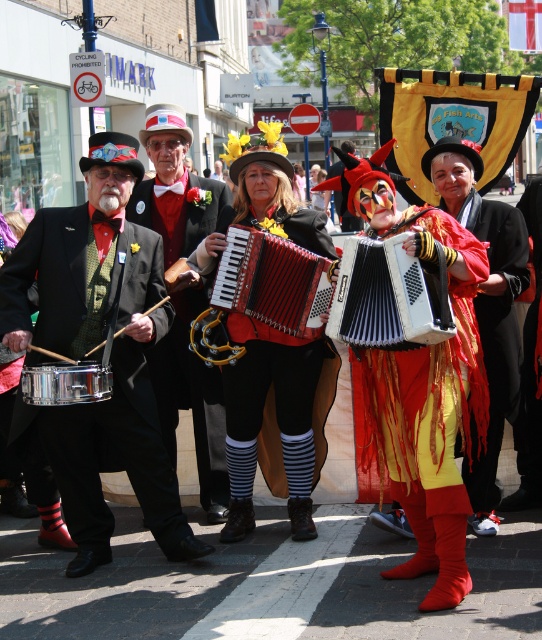
Does matte black accordion at center come in front of black leather accordion at center?

No, it is behind black leather accordion at center.

Is matte black accordion at center to the left of black leather accordion at center from the viewer's perspective?

Indeed, matte black accordion at center is positioned on the left side of black leather accordion at center.

Where is `matte black accordion at center`? matte black accordion at center is located at coordinates (191, 397).

Measure the distance from shiny black drum at left to brushed silver drum at lower left.

shiny black drum at left is 21.30 inches away from brushed silver drum at lower left.

Does shiny black drum at left appear over brushed silver drum at lower left?

Yes, shiny black drum at left is above brushed silver drum at lower left.

Locate an element on the screen. The height and width of the screenshot is (640, 542). shiny black drum at left is located at coordinates point(95,344).

Image resolution: width=542 pixels, height=640 pixels. I want to click on shiny black drum at left, so click(x=95, y=344).

Measure the distance from matte black accordion at center to white plastic accordion at center.

matte black accordion at center is 29.88 inches from white plastic accordion at center.

Can you confirm if matte black accordion at center is taller than white plastic accordion at center?

Indeed, matte black accordion at center has a greater height compared to white plastic accordion at center.

Measure the distance between point (159, 209) and camera.

Point (159, 209) is 28.25 feet away from camera.

You are a GUI agent. You are given a task and a screenshot of the screen. Output one action in this format:
    pyautogui.click(x=<x>, y=<y>)
    Task: Click on the matte black accordion at center
    This screenshot has height=640, width=542.
    Given the screenshot: What is the action you would take?
    pyautogui.click(x=191, y=397)